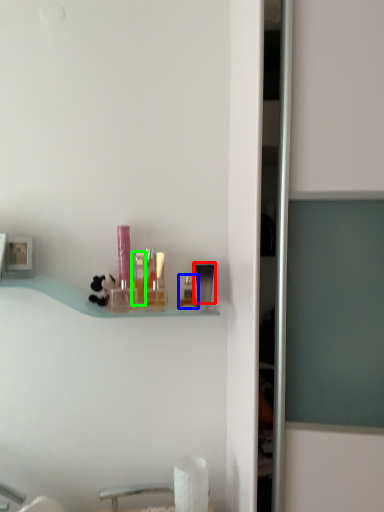
Question: Based on their relative distances, which object is nearer to toiletry (highlighted by a red box)? Choose from toiletry (highlighted by a blue box) and toiletry (highlighted by a green box).

Choices:
 (A) toiletry
 (B) toiletry

Answer: (A)